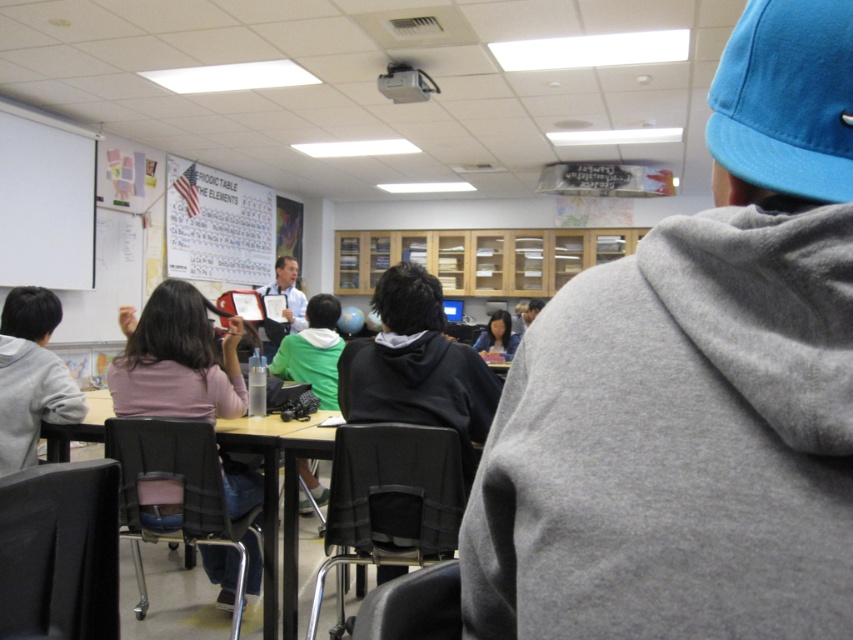
Question: Which point is closer to the camera?

Choices:
 (A) wooden table at center
 (B) green matte shirt at center

Answer: (A)

Question: Does pink fabric phone at center have a lesser width compared to green matte shirt at center?

Choices:
 (A) no
 (B) yes

Answer: (A)

Question: Which point is closer to the camera?

Choices:
 (A) (312, 332)
 (B) (167, 320)
 (C) (734, 60)
 (D) (227, 428)

Answer: (C)

Question: Does blue fabric baseball cap at upper right appear on the left side of green matte shirt at center?

Choices:
 (A) yes
 (B) no

Answer: (B)

Question: Does wooden table at center have a larger size compared to green matte shirt at center?

Choices:
 (A) no
 (B) yes

Answer: (B)

Question: Based on their relative distances, which object is farther from the pink fabric phone at center?

Choices:
 (A) light blue shirt at center
 (B) blue fabric baseball cap at upper right
 (C) green matte shirt at center

Answer: (A)